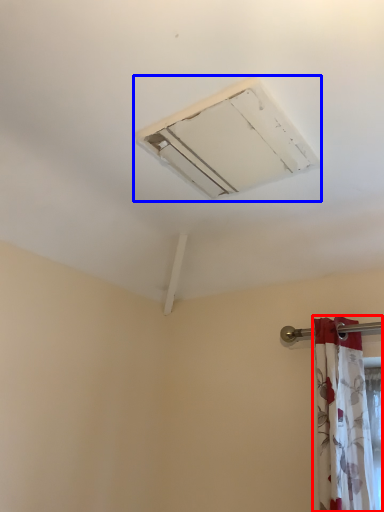
Question: Which point is closer to the camera, curtain (highlighted by a red box) or air conditioning (highlighted by a blue box)?

Choices:
 (A) curtain
 (B) air conditioning

Answer: (B)